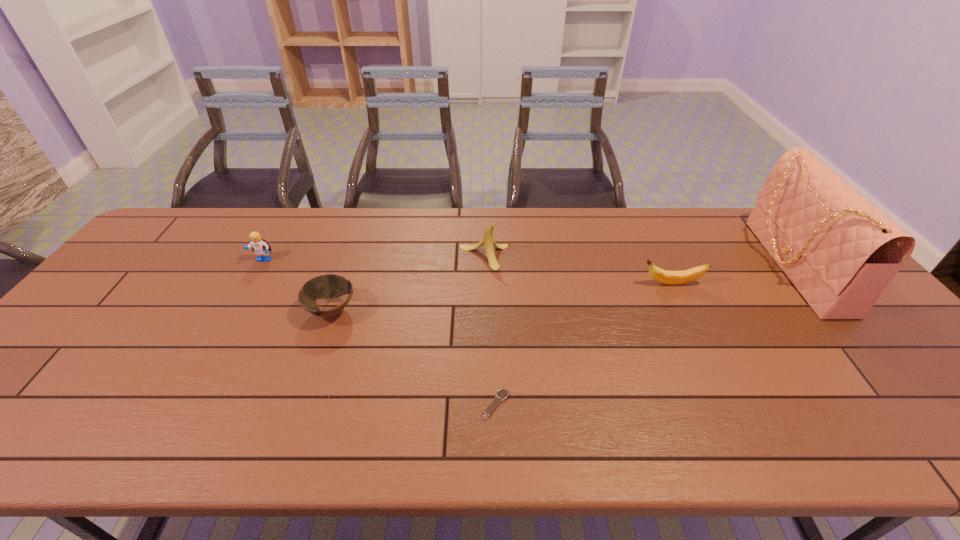
Locate an element on the screen. vacant area situated on the back of the nearest object is located at coordinates (492, 299).

Where is `handbag that is positioned at the far edge`? handbag that is positioned at the far edge is located at coordinates (840, 252).

Where is `banana that is positioned at the far edge`? Image resolution: width=960 pixels, height=540 pixels. banana that is positioned at the far edge is located at coordinates (488, 239).

This screenshot has width=960, height=540. In order to click on object that is at the near edge in this screenshot , I will do `click(502, 394)`.

Find the location of a particular element. This screenshot has width=960, height=540. object that is at the right edge is located at coordinates (840, 252).

Image resolution: width=960 pixels, height=540 pixels. I want to click on object at the far right corner, so click(840, 252).

Find the location of a particular element. vacant space at the far edge of the desktop is located at coordinates (639, 230).

Where is `vacant space at the near edge of the desktop`? vacant space at the near edge of the desktop is located at coordinates pos(84,440).

Where is `vacant space at the near right corner`? vacant space at the near right corner is located at coordinates (930, 442).

Identify the location of free space between the nearer banana and the Lego. This screenshot has height=540, width=960. (468, 272).